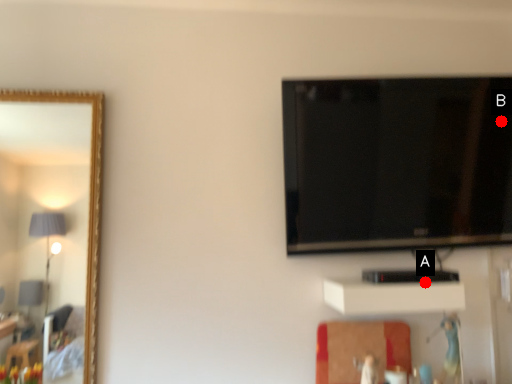
Question: Two points are circled on the image, labeled by A and B beside each circle. Which point appears closest to the camera in this image?

Choices:
 (A) A is closer
 (B) B is closer

Answer: (A)